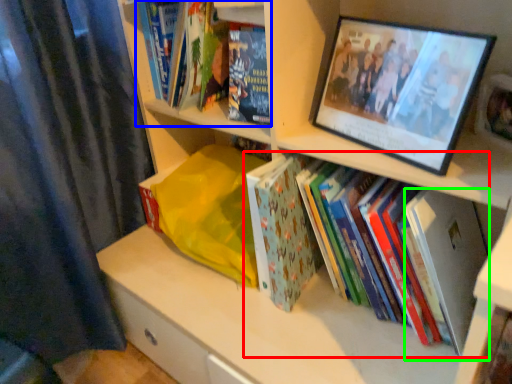
Question: Which object is the farthest from book (highlighted by a red box)? Choose among these: book (highlighted by a blue box) or paperback book (highlighted by a green box).

Choices:
 (A) book
 (B) paperback book

Answer: (A)